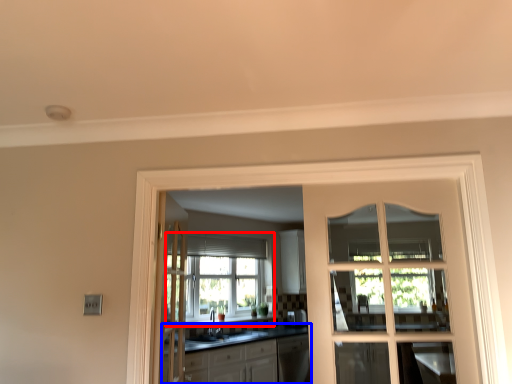
Question: Which object appears farthest to the camera in this image, window (highlighted by a red box) or cabinetry (highlighted by a blue box)?

Choices:
 (A) window
 (B) cabinetry

Answer: (A)